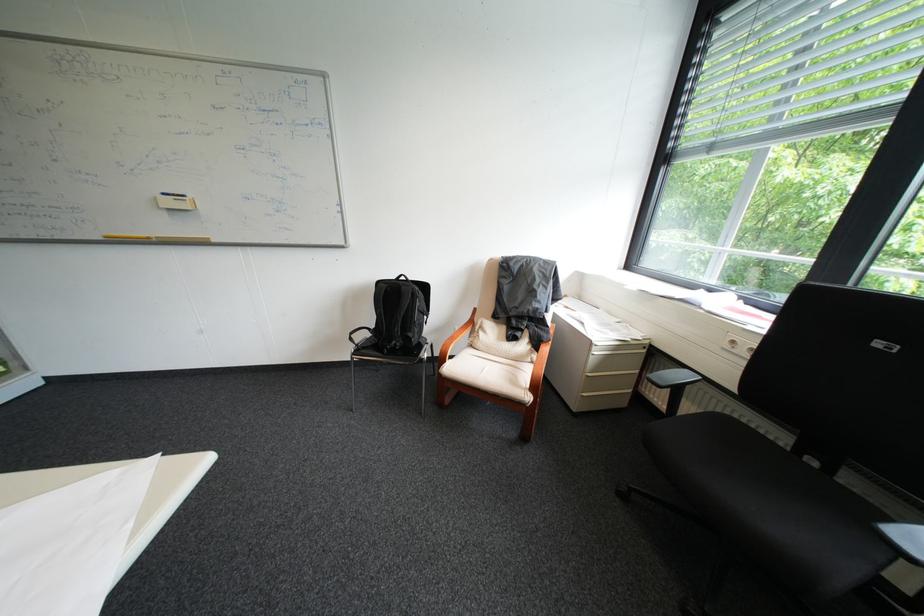
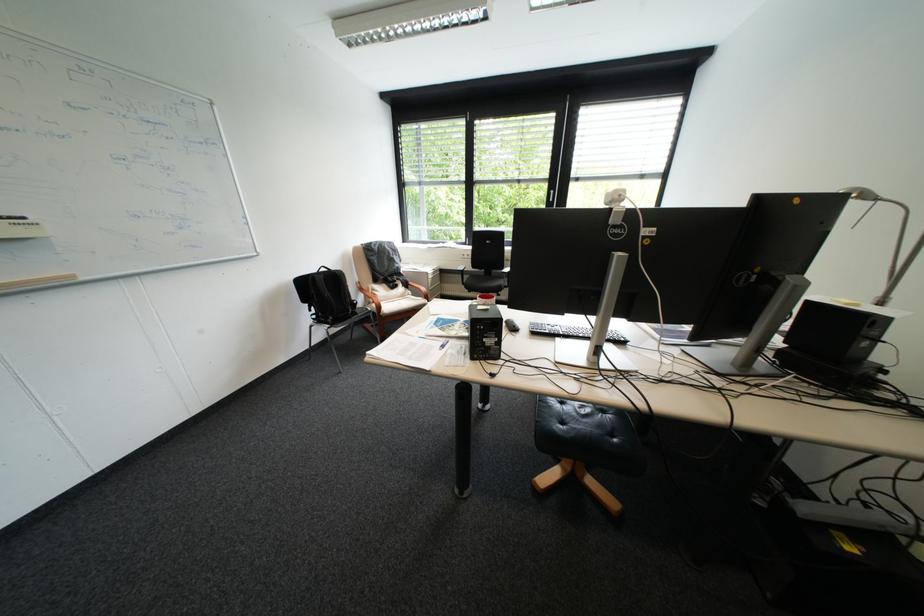
Find the pixel in the second image that matches point (456, 363) in the first image.

(394, 309)